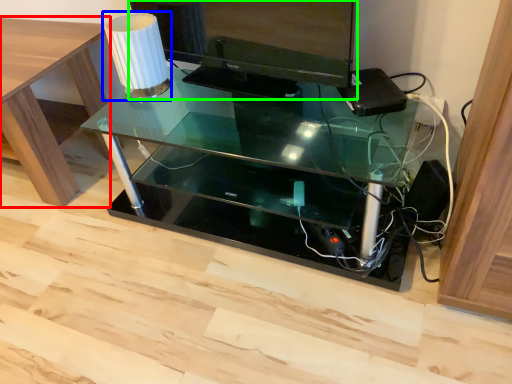
Question: Which is farther away from table (highlighted by a red box)? table lamp (highlighted by a blue box) or computer monitor (highlighted by a green box)?

Choices:
 (A) table lamp
 (B) computer monitor

Answer: (B)